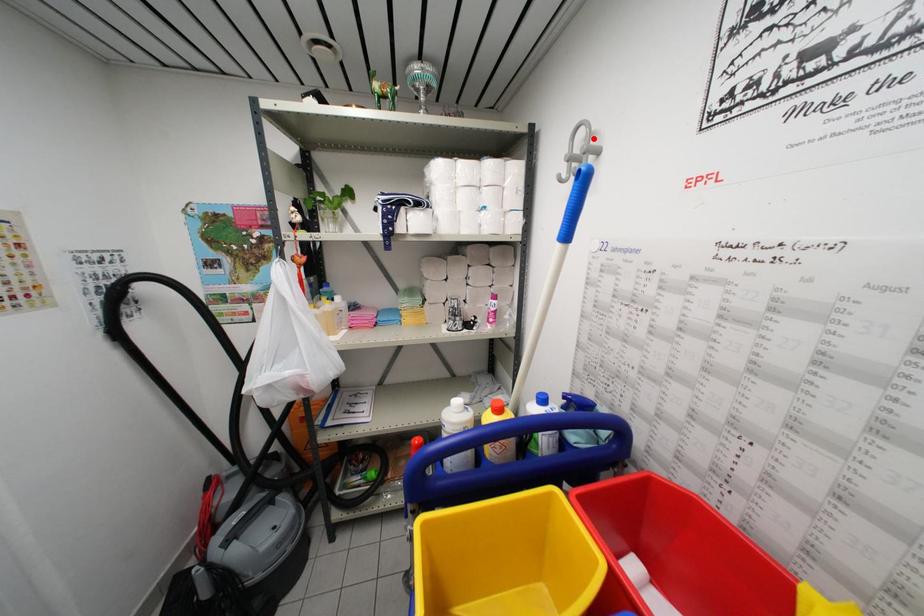
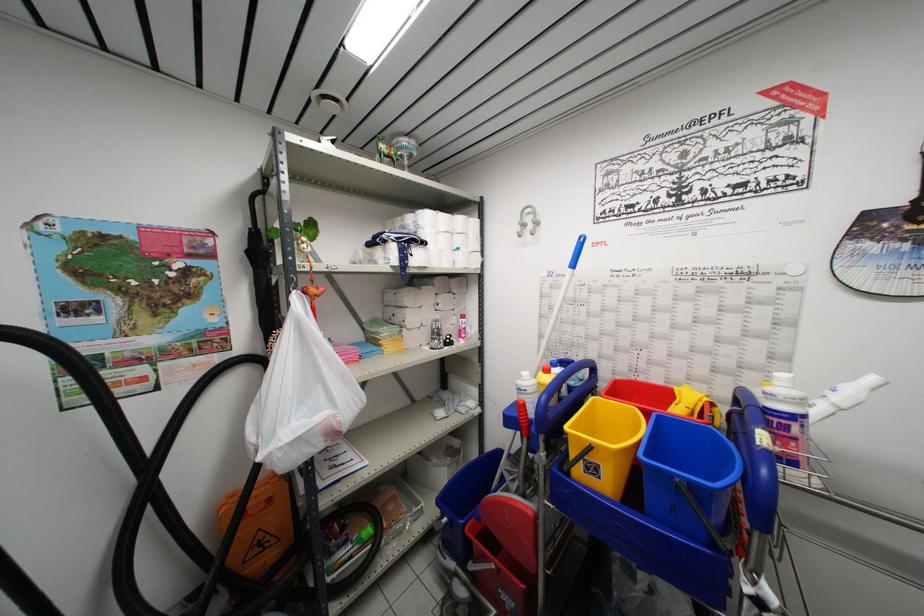
The point at the highlighted location is marked in the first image. Where is the corresponding point in the second image?

(537, 217)